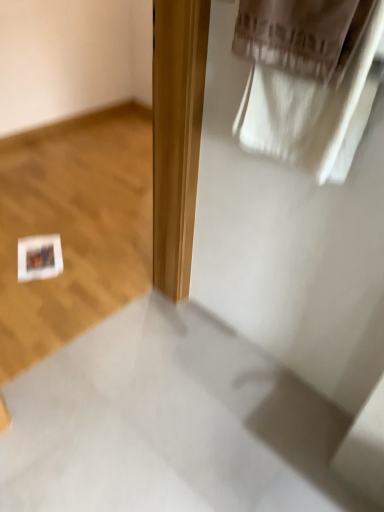
The height and width of the screenshot is (512, 384). What are the coordinates of `free region under white textured curtain at upper right (from a real-world perspective)` in the screenshot? It's located at (242, 357).